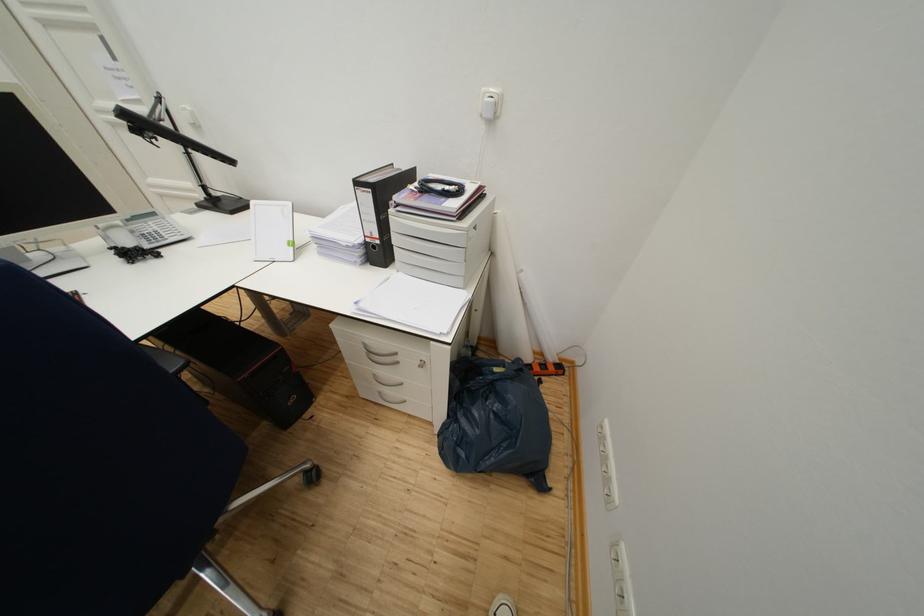
What do you see at coordinates (164, 131) in the screenshot?
I see `a black lamp arm` at bounding box center [164, 131].